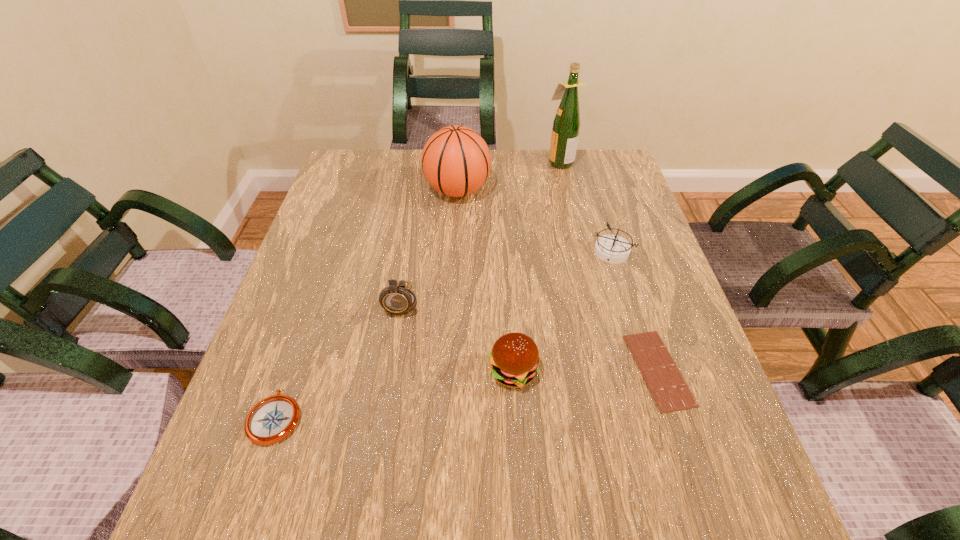
Find the location of a particular element. This screenshot has width=960, height=540. vacant space that satisfies the following two spatial constraints: 1. on the back side of the sixth tallest object; 2. on the right side of the fifth tallest object is located at coordinates (332, 252).

Where is `vacant space that satisfies the following two spatial constraints: 1. on the front-facing side of the tallest object; 2. on the right side of the shortest object`? vacant space that satisfies the following two spatial constraints: 1. on the front-facing side of the tallest object; 2. on the right side of the shortest object is located at coordinates (608, 370).

This screenshot has width=960, height=540. Identify the location of vacant space that satisfies the following two spatial constraints: 1. on the back side of the fourth shortest object; 2. on the left side of the chocolate bar. (513, 370).